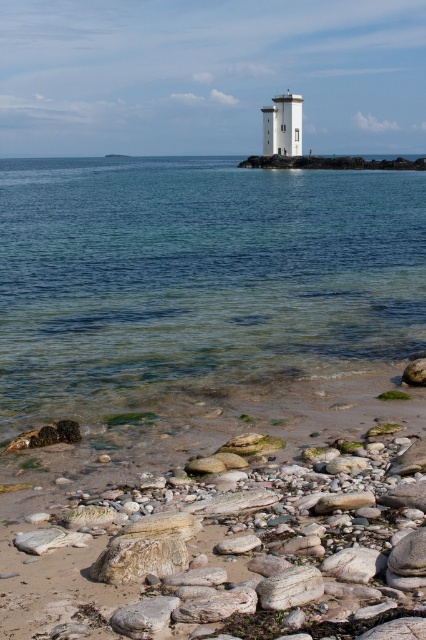
You are standing on the beach looking towards the lighthouse. There are two points marked on the ground in front of you. The first point is at coordinate point(x=400, y=188) and the second is at point(x=275, y=116). Which point is closer to you?

Point(x=400, y=188) is in front of point(x=275, y=116), so it is closer to you.

You are a photographer standing on the beach and want to capture both the smooth white stones at lower center and the white smooth tower at center in your shot. Which object will appear larger in the photo?

The white smooth tower at center will appear larger in the photo because it is taller than the smooth white stones at lower center.

You are standing on the beach looking at the lighthouse. There are two points marked on the image. One is at coordinates point [201,307] and the other is at point [103,620]. Which point is closer to you?

Point [103,620] is closer to you because it is less far from the camera than point [201,307].